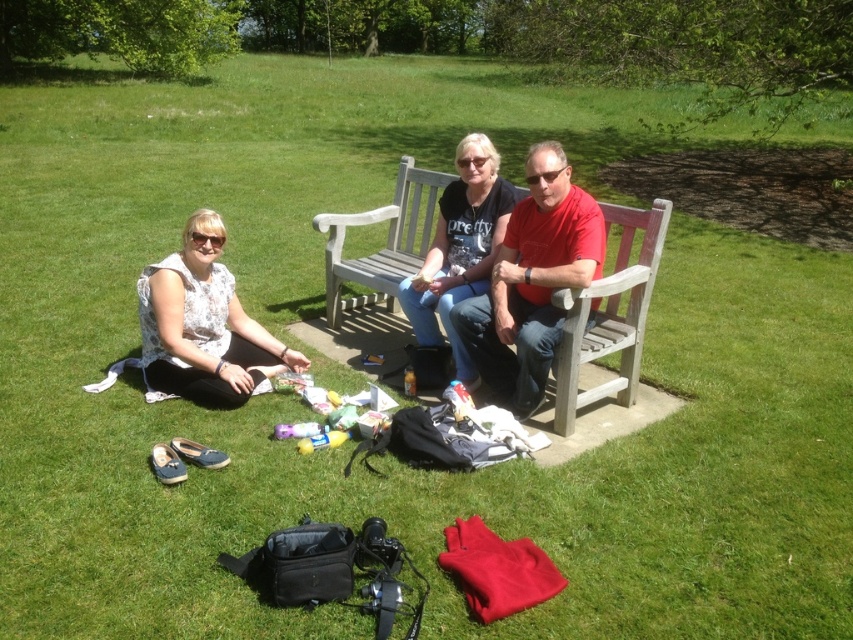
Question: Which of these objects is positioned farthest from the red matte shirt at center?

Choices:
 (A) white floral dress at lower left
 (B) wooden park bench at center

Answer: (A)

Question: Is red matte shirt at center to the left of matte black t-shirt at center from the viewer's perspective?

Choices:
 (A) yes
 (B) no

Answer: (B)

Question: Which point is closer to the camera?

Choices:
 (A) (624, 358)
 (B) (165, 262)
 (C) (436, 301)
 (D) (524, 396)

Answer: (B)

Question: Does white floral dress at lower left have a lesser width compared to matte black t-shirt at center?

Choices:
 (A) yes
 (B) no

Answer: (B)

Question: Does wooden park bench at center have a greater width compared to matte black t-shirt at center?

Choices:
 (A) no
 (B) yes

Answer: (B)

Question: Which point is farther to the camera?

Choices:
 (A) matte black t-shirt at center
 (B) white floral dress at lower left
 (C) red matte shirt at center

Answer: (A)